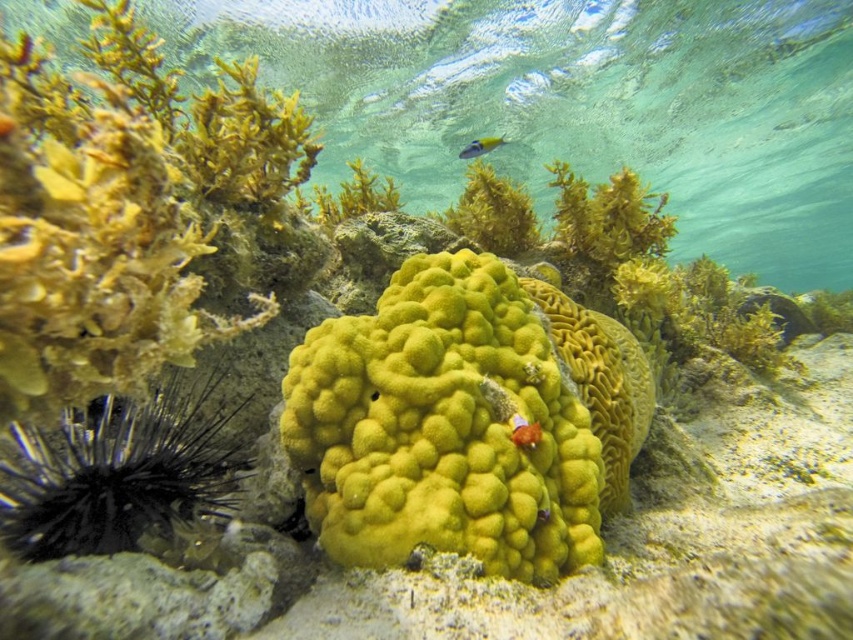
Question: Is green coral at center wider than green matte algae at upper center?

Choices:
 (A) yes
 (B) no

Answer: (B)

Question: Which object is positioned farthest from the orange matte fish at center?

Choices:
 (A) green coral at center
 (B) green matte algae at upper center
 (C) yellow sponge at center
 (D) black spiny sea urchin at left

Answer: (A)

Question: Estimate the real-world distances between objects in this image. Which object is closer to the yellow sponge at center?

Choices:
 (A) orange matte fish at center
 (B) green coral at center

Answer: (A)

Question: Which of the following is the closest to the observer?

Choices:
 (A) green fuzzy algae at upper center
 (B) yellow sponge at center
 (C) yellow-green textured fish at upper center
 (D) green matte algae at center

Answer: (B)

Question: Does green coral at center have a greater width compared to orange matte fish at center?

Choices:
 (A) no
 (B) yes

Answer: (B)

Question: Considering the relative positions of green coral at center and yellow sponge at center in the image provided, where is green coral at center located with respect to yellow sponge at center?

Choices:
 (A) above
 (B) below

Answer: (A)